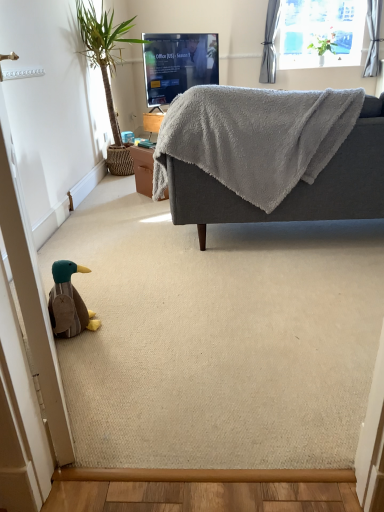
The image size is (384, 512). What do you see at coordinates (178, 64) in the screenshot?
I see `matte black tv at upper center` at bounding box center [178, 64].

Identify the location of brown plush duck at lower left. (69, 302).

Measure the distance between point (128, 41) and camera.

Point (128, 41) is 4.05 meters from camera.

Where is `gray soft fabric couch at upper right`? This screenshot has width=384, height=512. gray soft fabric couch at upper right is located at coordinates (291, 192).

Where is `transparent glass window at upper center`? transparent glass window at upper center is located at coordinates (320, 33).

Image resolution: width=384 pixels, height=512 pixels. Find the location of `matte black tv at upper center`. matte black tv at upper center is located at coordinates (178, 64).

What's the angular difference between gray fabric curtain at upper right and brown plush duck at lower left's facing directions?

114 degrees separate the facing orientations of gray fabric curtain at upper right and brown plush duck at lower left.

Considering the relative positions of gray fabric curtain at upper right and brown plush duck at lower left in the image provided, is gray fabric curtain at upper right to the left or to the right of brown plush duck at lower left?

In the image, gray fabric curtain at upper right appears on the right side of brown plush duck at lower left.

From the picture: Is gray fabric curtain at upper right shorter than brown plush duck at lower left?

In fact, gray fabric curtain at upper right may be taller than brown plush duck at lower left.

Which is behind, gray fabric curtain at upper right or brown plush duck at lower left?

Positioned behind is gray fabric curtain at upper right.

From a real-world perspective, who is located higher, green leafy plant at left or gray fabric curtain at upper right?

From a 3D spatial view, gray fabric curtain at upper right is above.

Consider the image. Is green leafy plant at left facing towards gray fabric curtain at upper right?

No, green leafy plant at left is not oriented towards gray fabric curtain at upper right.

Where is `houseplant below the gray fabric curtain at upper right (from the image's perspective)`? Image resolution: width=384 pixels, height=512 pixels. houseplant below the gray fabric curtain at upper right (from the image's perspective) is located at coordinates (107, 71).

Which of these two, green leafy plant at left or gray fabric curtain at upper right, stands shorter?

With less height is gray fabric curtain at upper right.

Is transparent glass window at upper center at the right side of gray fabric curtain at upper right?

Yes.

Which is closer, (344, 56) or (263, 79)?

Positioned in front is point (263, 79).

Considering the relative sizes of transparent glass window at upper center and gray fabric curtain at upper right in the image provided, is transparent glass window at upper center taller than gray fabric curtain at upper right?

No.

Locate an element on the screen. The image size is (384, 512). window that is above the gray fabric curtain at upper right (from the image's perspective) is located at coordinates (320, 33).

Which object is positioned more to the left, green leafy plant at upper right or brown plush duck at lower left?

brown plush duck at lower left is more to the left.

Is green leafy plant at upper right further to camera compared to brown plush duck at lower left?

Yes, it is.

From a real-world perspective, is green leafy plant at upper right positioned over brown plush duck at lower left based on gravity?

Yes, from a real-world perspective, green leafy plant at upper right is on top of brown plush duck at lower left.

Looking at this image, from the image's perspective, does green leafy plant at upper right appear higher than brown plush duck at lower left?

Correct, green leafy plant at upper right appears higher than brown plush duck at lower left in the image.

Is matte black tv at upper center turned away from brown plush duck at lower left?

No.

Which object is further away from the camera taking this photo, matte black tv at upper center or brown plush duck at lower left?

matte black tv at upper center is behind.

Can you confirm if matte black tv at upper center is taller than brown plush duck at lower left?

Correct, matte black tv at upper center is much taller as brown plush duck at lower left.

Is green leafy plant at left looking in the opposite direction of transparent glass window at upper center?

That's not correct — green leafy plant at left is not looking away from transparent glass window at upper center.

In the image, there is a green leafy plant at left. Identify the location of window above it (from the image's perspective). (320, 33).

Can you confirm if green leafy plant at left is shorter than transparent glass window at upper center?

In fact, green leafy plant at left may be taller than transparent glass window at upper center.

From a real-world perspective, which object rests below the other?

From a 3D spatial view, matte black tv at upper center is below.

Which of these two, gray fabric curtain at upper right or matte black tv at upper center, is bigger?

With larger size is matte black tv at upper center.

Would you say gray fabric curtain at upper right is to the left or to the right of matte black tv at upper center in the picture?

From the image, it's evident that gray fabric curtain at upper right is to the right of matte black tv at upper center.

From the image's perspective, relative to matte black tv at upper center, is gray fabric curtain at upper right above or below?

Based on their image positions, gray fabric curtain at upper right is located above matte black tv at upper center.

Identify the location of toy below the gray fabric curtain at upper right (from the image's perspective). pos(69,302).

Find the location of a particular element. The width and height of the screenshot is (384, 512). curtain that is above the green leafy plant at left (from the image's perspective) is located at coordinates (270, 42).

From the image, which object appears to be farther from gray soft fabric couch at upper right, green leafy plant at upper right or transparent glass window at upper center?

green leafy plant at upper right is further to gray soft fabric couch at upper right.

When comparing their distances from gray soft fabric couch at upper right, does brown plush duck at lower left or gray fabric curtain at upper right seem further?

The object further to gray soft fabric couch at upper right is gray fabric curtain at upper right.

Based on their spatial positions, is transparent glass window at upper center or gray soft fabric couch at upper right closer to green leafy plant at upper right?

transparent glass window at upper center is positioned closer to the anchor green leafy plant at upper right.

When comparing their distances from transparent glass window at upper center, does gray fabric curtain at upper right or brown plush duck at lower left seem closer?

gray fabric curtain at upper right is closer to transparent glass window at upper center.

Based on their spatial positions, is green leafy plant at upper right or gray soft fabric couch at upper right further from matte black tv at upper center?

gray soft fabric couch at upper right is further to matte black tv at upper center.

Based on their spatial positions, is gray soft fabric couch at upper right or matte black tv at upper center further from green leafy plant at left?

gray soft fabric couch at upper right.

Estimate the real-world distances between objects in this image. Which object is closer to matte black tv at upper center, green leafy plant at left or brown plush duck at lower left?

green leafy plant at left is closer to matte black tv at upper center.

From the image, which object appears to be nearer to gray soft fabric couch at upper right, gray fabric curtain at upper right or green leafy plant at upper right?

The object closer to gray soft fabric couch at upper right is gray fabric curtain at upper right.

Image resolution: width=384 pixels, height=512 pixels. Find the location of `curtain between brown plush duck at lower left and green leafy plant at upper right from front to back`. curtain between brown plush duck at lower left and green leafy plant at upper right from front to back is located at coordinates (270, 42).

The image size is (384, 512). Identify the location of television located between brown plush duck at lower left and transparent glass window at upper center in the depth direction. (178, 64).

Locate an element on the screen. The height and width of the screenshot is (512, 384). houseplant positioned between gray soft fabric couch at upper right and green leafy plant at upper right from near to far is located at coordinates (107, 71).

Where is `television positioned between gray soft fabric couch at upper right and transparent glass window at upper center from near to far`? The height and width of the screenshot is (512, 384). television positioned between gray soft fabric couch at upper right and transparent glass window at upper center from near to far is located at coordinates (178, 64).